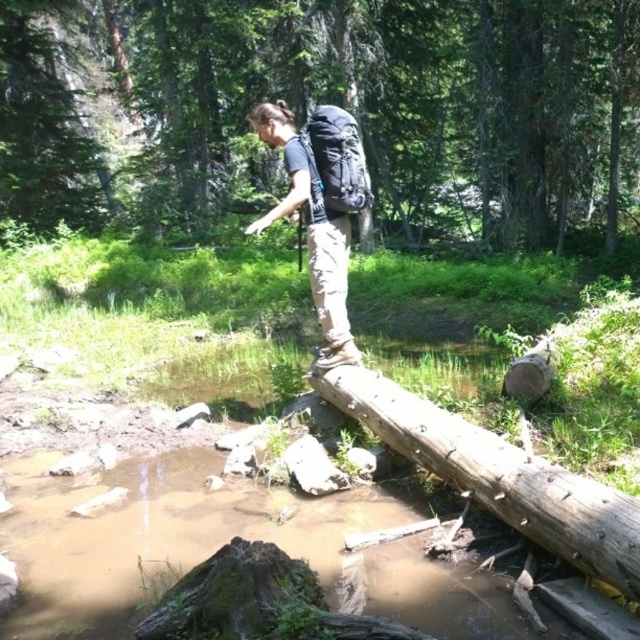
This screenshot has height=640, width=640. What are the coordinates of `brown rough wood log at center` in the screenshot? It's located at (499, 476).

Does brown rough wood log at center appear on the right side of matte black backpack at center?

Yes, brown rough wood log at center is to the right of matte black backpack at center.

Is point (628, 548) positioned after point (349, 144)?

No, it is not.

In order to click on brown rough wood log at center in this screenshot , I will do `click(499, 476)`.

Identify the location of brown rough log at center. (326, 100).

Can you confirm if brown rough log at center is shorter than matte black backpack at center?

No, brown rough log at center is not shorter than matte black backpack at center.

Locate an element on the screen. brown rough log at center is located at coordinates (326, 100).

The image size is (640, 640). What are the coordinates of `brown rough log at center` in the screenshot? It's located at (326, 100).

Who is more forward, (547, 148) or (340, 376)?

Point (340, 376) is in front.

Is brown rough log at center to the right of brown rough wood log at center from the viewer's perspective?

Incorrect, brown rough log at center is not on the right side of brown rough wood log at center.

The height and width of the screenshot is (640, 640). I want to click on brown rough log at center, so click(x=326, y=100).